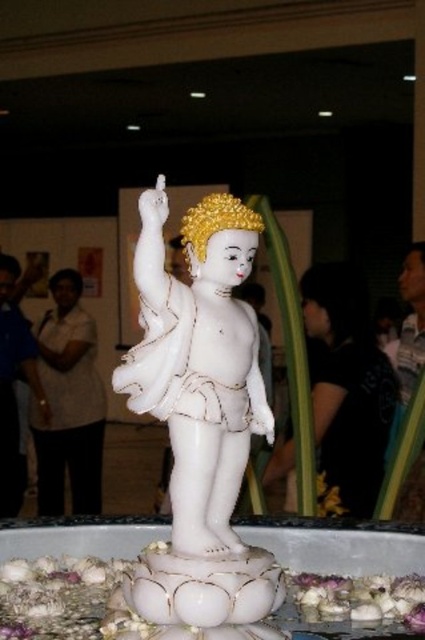
How far apart are white matte statue at center and white fabric shirt at left?

The distance of white matte statue at center from white fabric shirt at left is 3.61 inches.

Does white matte statue at center appear over white fabric shirt at left?

No.

What do you see at coordinates (68, 403) in the screenshot? This screenshot has width=425, height=640. I see `white matte statue at center` at bounding box center [68, 403].

At what (x,y) coordinates should I click in order to perform the action: click on white matte statue at center. Please return your answer as a coordinate pair (x, y). Looking at the image, I should click on (68, 403).

Is point (56, 493) farther from viewer compared to point (385, 611)?

Yes, point (56, 493) is behind point (385, 611).

Where is `white matte statue at center`? The image size is (425, 640). white matte statue at center is located at coordinates (x=68, y=403).

Find the location of a particular element. white matte statue at center is located at coordinates (68, 403).

Is white marble statue at center positioned behind white fabric shirt at left?

No, white marble statue at center is closer to the viewer.

Which is more to the right, white marble statue at center or white fabric shirt at left?

white marble statue at center is more to the right.

Is point (212, 218) positioned behind point (11, 262)?

No, (212, 218) is in front of (11, 262).

Find the location of a particular element. white marble statue at center is located at coordinates (198, 428).